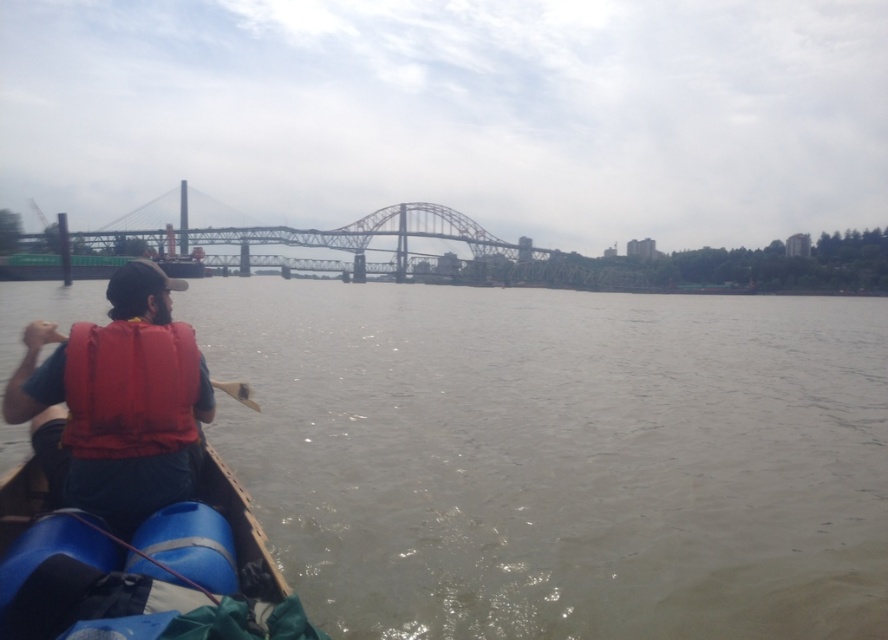
You are a safety inspector checking the visibility of life jackets on a canoe. You notice two life jackets, the matte orange life vest at lower left and the red matte life jacket at left. Which one has a higher profile and is more visible from above?

The matte orange life vest at lower left has a greater height compared to the red matte life jacket at left, making it more visible from above.

You are a safety inspector assessing the distance between the blue rubber boat at lower left and the wooden paddle at center. According to safety regulations, the minimum distance between any two objects on the water must be at least 15 meters to ensure safe navigation. Is the current distance compliant with the regulations?

The blue rubber boat at lower left and wooden paddle at center are 14.02 meters apart from each other, which is less than the required 15 meters. Therefore, the current distance does not comply with the safety regulations.